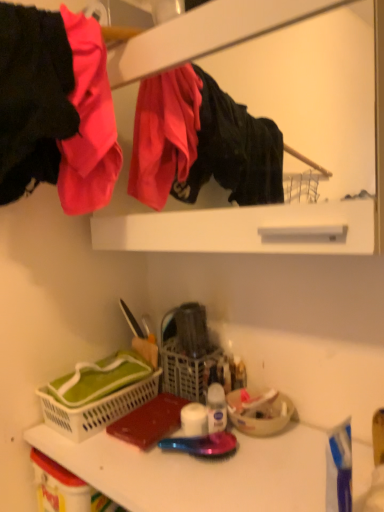
The image size is (384, 512). I want to click on empty space that is to the right of white matte toilet paper at center, so click(x=282, y=451).